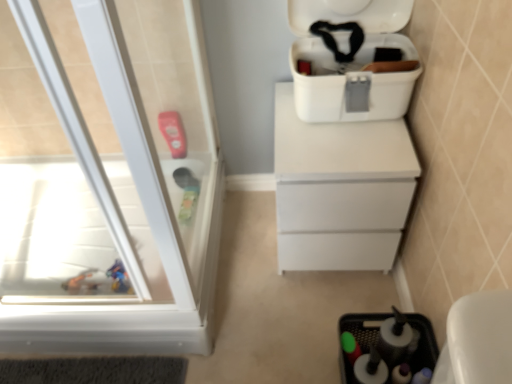
Question: From a real-world perspective, is black plastic sink at lower right over white plastic cooler at upper right?

Choices:
 (A) no
 (B) yes

Answer: (A)

Question: Does black plastic sink at lower right have a smaller size compared to white plastic cooler at upper right?

Choices:
 (A) yes
 (B) no

Answer: (A)

Question: From the image's perspective, is black plastic sink at lower right beneath white plastic cooler at upper right?

Choices:
 (A) yes
 (B) no

Answer: (A)

Question: Considering the relative positions of black plastic sink at lower right and white plastic cooler at upper right in the image provided, is black plastic sink at lower right to the left of white plastic cooler at upper right from the viewer's perspective?

Choices:
 (A) yes
 (B) no

Answer: (B)

Question: Is black plastic sink at lower right turned away from white plastic cooler at upper right?

Choices:
 (A) no
 (B) yes

Answer: (A)

Question: In the image, is white matte chest of drawers at center on the left side or the right side of black plastic sink at lower right?

Choices:
 (A) right
 (B) left

Answer: (B)

Question: Would you say white matte chest of drawers at center is inside or outside black plastic sink at lower right?

Choices:
 (A) inside
 (B) outside

Answer: (B)

Question: Is point (287, 183) closer or farther from the camera than point (478, 382)?

Choices:
 (A) farther
 (B) closer

Answer: (A)

Question: Considering the positions of white matte chest of drawers at center and black plastic sink at lower right in the image, is white matte chest of drawers at center wider or thinner than black plastic sink at lower right?

Choices:
 (A) wide
 (B) thin

Answer: (A)

Question: Visually, is white matte chest of drawers at center positioned to the left or to the right of transparent plastic screen door at left?

Choices:
 (A) right
 (B) left

Answer: (A)

Question: Is white matte chest of drawers at center wider or thinner than transparent plastic screen door at left?

Choices:
 (A) wide
 (B) thin

Answer: (A)

Question: Does point (290, 105) appear closer or farther from the camera than point (80, 100)?

Choices:
 (A) farther
 (B) closer

Answer: (B)

Question: From the image's perspective, is white matte chest of drawers at center located above or below transparent plastic screen door at left?

Choices:
 (A) above
 (B) below

Answer: (B)

Question: From a real-world perspective, is black plastic sink at lower right above or below white plastic cooler at upper right?

Choices:
 (A) above
 (B) below

Answer: (B)

Question: Considering the relative positions of black plastic sink at lower right and white plastic cooler at upper right in the image provided, is black plastic sink at lower right to the left or to the right of white plastic cooler at upper right?

Choices:
 (A) right
 (B) left

Answer: (A)